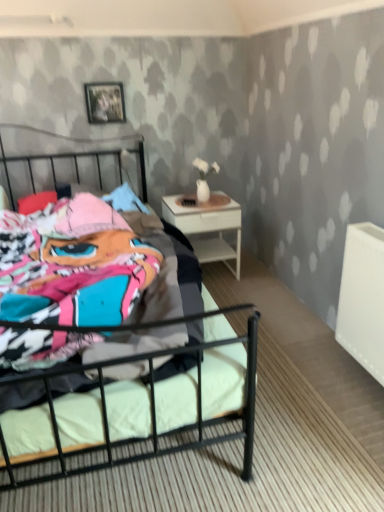
Where is `white glossy nightstand at right`? white glossy nightstand at right is located at coordinates (208, 227).

Identify the location of metallic silver picture frame at upper center. Image resolution: width=384 pixels, height=512 pixels. (105, 102).

Image resolution: width=384 pixels, height=512 pixels. I want to click on white glossy nightstand at right, so click(x=208, y=227).

Looking at this image, which object is closer to the camera taking this photo, metallic silver picture frame at upper center or white glossy nightstand at right?

Positioned in front is white glossy nightstand at right.

In the scene shown: From a real-world perspective, which object rests below the other?

white glossy nightstand at right is physically lower.

Between metallic silver picture frame at upper center and white glossy nightstand at right, which one has smaller width?

With smaller width is metallic silver picture frame at upper center.

Is metallic silver picture frame at upper center inside or outside of white glossy nightstand at right?

metallic silver picture frame at upper center is not enclosed by white glossy nightstand at right.

Which of these two, white glossy nightstand at right or metallic black bed at center, is smaller?

white glossy nightstand at right.

Does white glossy nightstand at right turn towards metallic black bed at center?

No, white glossy nightstand at right is not facing towards metallic black bed at center.

Which is more to the right, white glossy nightstand at right or metallic black bed at center?

white glossy nightstand at right.

How different are the orientations of white glossy nightstand at right and metallic black bed at center in degrees?

The angle between the facing direction of white glossy nightstand at right and the facing direction of metallic black bed at center is 0.549 degrees.

Is metallic silver picture frame at upper center facing away from metallic black bed at center?

No.

Is metallic silver picture frame at upper center wider than metallic black bed at center?

No.

Are metallic silver picture frame at upper center and metallic black bed at center making contact?

metallic silver picture frame at upper center and metallic black bed at center are clearly separated.

Looking at their sizes, would you say metallic black bed at center is wider or thinner than white glossy nightstand at right?

Clearly, metallic black bed at center has more width compared to white glossy nightstand at right.

Would you consider metallic black bed at center to be distant from white glossy nightstand at right?

No, metallic black bed at center is not far away from white glossy nightstand at right.

What's the angular difference between metallic black bed at center and white glossy nightstand at right's facing directions?

The facing directions of metallic black bed at center and white glossy nightstand at right are 0.549 degrees apart.

Considering the positions of objects white glossy nightstand at right and metallic silver picture frame at upper center in the image provided, who is in front, white glossy nightstand at right or metallic silver picture frame at upper center?

white glossy nightstand at right is more forward.

How distant is white glossy nightstand at right from metallic silver picture frame at upper center?

white glossy nightstand at right is 92.04 centimeters from metallic silver picture frame at upper center.

Which is more to the left, white glossy nightstand at right or metallic silver picture frame at upper center?

From the viewer's perspective, metallic silver picture frame at upper center appears more on the left side.

What's the angular difference between white glossy nightstand at right and metallic silver picture frame at upper center's facing directions?

They differ by 0.854 degrees in their facing directions.

Considering the sizes of objects metallic black bed at center and metallic silver picture frame at upper center in the image provided, who is taller, metallic black bed at center or metallic silver picture frame at upper center?

Standing taller between the two is metallic black bed at center.

From a real-world perspective, is metallic black bed at center on metallic silver picture frame at upper center?

No, from a real-world perspective, metallic black bed at center is not over metallic silver picture frame at upper center

Are metallic black bed at center and metallic silver picture frame at upper center beside each other?

No, metallic black bed at center is not making contact with metallic silver picture frame at upper center.

How many degrees apart are the facing directions of metallic black bed at center and metallic silver picture frame at upper center?

There is a 0.305-degree angle between the facing directions of metallic black bed at center and metallic silver picture frame at upper center.

Locate an element on the screen. This screenshot has height=512, width=384. nightstand that is below the metallic silver picture frame at upper center (from the image's perspective) is located at coordinates (208, 227).

Locate an element on the screen. This screenshot has height=512, width=384. nightstand below the metallic black bed at center (from a real-world perspective) is located at coordinates (208, 227).

When comparing their distances from white glossy nightstand at right, does metallic silver picture frame at upper center or metallic black bed at center seem closer?

Among the two, metallic black bed at center is located nearer to white glossy nightstand at right.

Considering their positions, is metallic silver picture frame at upper center positioned closer to metallic black bed at center than white glossy nightstand at right?

Based on the image, white glossy nightstand at right appears to be nearer to metallic black bed at center.

Looking at the image, which one is located closer to metallic black bed at center, white glossy nightstand at right or metallic silver picture frame at upper center?

white glossy nightstand at right lies closer to metallic black bed at center than the other object.

Based on their spatial positions, is metallic black bed at center or white glossy nightstand at right closer to metallic silver picture frame at upper center?

The object closer to metallic silver picture frame at upper center is white glossy nightstand at right.

From the image, which object appears to be nearer to metallic silver picture frame at upper center, white glossy nightstand at right or metallic black bed at center?

white glossy nightstand at right lies closer to metallic silver picture frame at upper center than the other object.

When comparing their distances from white glossy nightstand at right, does metallic black bed at center or metallic silver picture frame at upper center seem further?

Based on the image, metallic silver picture frame at upper center appears to be further to white glossy nightstand at right.

Where is `nightstand between metallic black bed at center and metallic silver picture frame at upper center along the z-axis`? This screenshot has width=384, height=512. nightstand between metallic black bed at center and metallic silver picture frame at upper center along the z-axis is located at coordinates (208, 227).